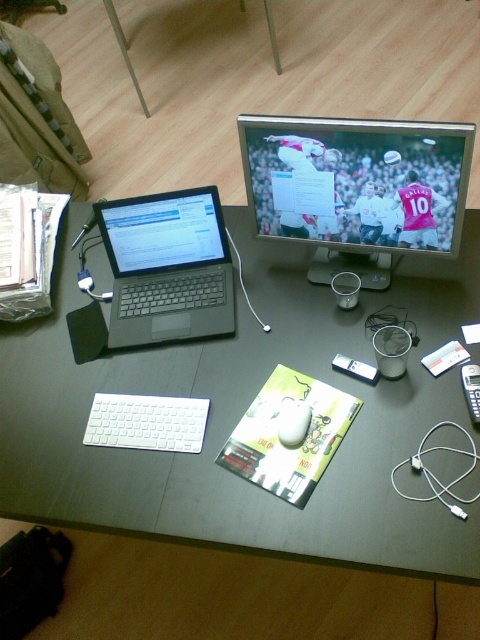
Is point (428, 124) behind point (158, 260)?

No, (428, 124) is closer to viewer.

Between matte black monitor at center and sleek black laptop at left, which one appears on the left side from the viewer's perspective?

From the viewer's perspective, sleek black laptop at left appears more on the left side.

At what (x,y) coordinates should I click in order to perform the action: click on matte black monitor at center. Please return your answer as a coordinate pair (x, y). The image size is (480, 640). Looking at the image, I should click on (357, 188).

How distant is dark wood table at center from sleek black laptop at left?

dark wood table at center and sleek black laptop at left are 7.66 inches apart from each other.

Which is below, dark wood table at center or sleek black laptop at left?

dark wood table at center

Is point (423, 314) less distant than point (151, 228)?

That is True.

Locate an element on the screen. The width and height of the screenshot is (480, 640). dark wood table at center is located at coordinates (241, 413).

Is matte black monitor at center below white matte mouse at center?

Actually, matte black monitor at center is above white matte mouse at center.

Is matte black monitor at center to the right of white matte mouse at center from the viewer's perspective?

Yes, matte black monitor at center is to the right of white matte mouse at center.

Is point (316, 141) closer to viewer compared to point (301, 403)?

Yes, point (316, 141) is in front of point (301, 403).

Locate an element on the screen. This screenshot has width=480, height=640. matte black monitor at center is located at coordinates [357, 188].